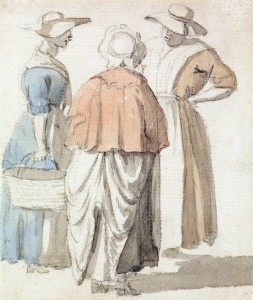
Locate an element on the screen. This screenshot has width=253, height=300. old fashioned basket is located at coordinates (38, 188).